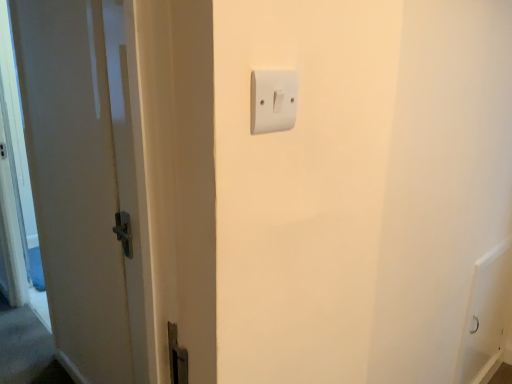
Describe the element at coordinates (273, 100) in the screenshot. I see `white plastic light switch at upper center` at that location.

Locate an element on the screen. white plastic light switch at upper center is located at coordinates (273, 100).

Identify the location of white plastic light switch at upper center. (273, 100).